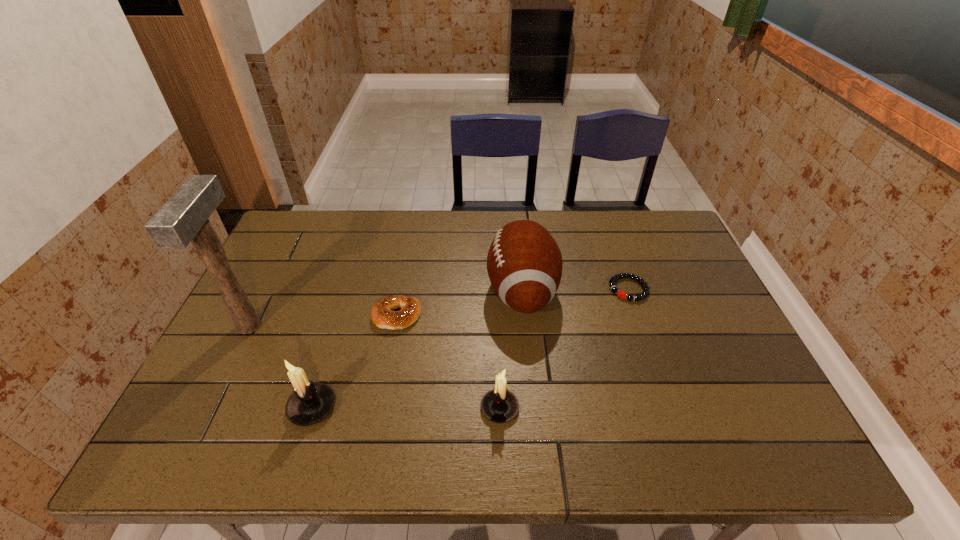
The candle holders are evenly distributed in the image. To maintain this, where would you place another candle holder on the right? Please point to a free space. Please provide its 2D coordinates. Your answer should be formatted as a tuple, i.e. [(x, y)], where the tuple contains the x and y coordinates of a point satisfying the conditions above.

[(688, 409)]